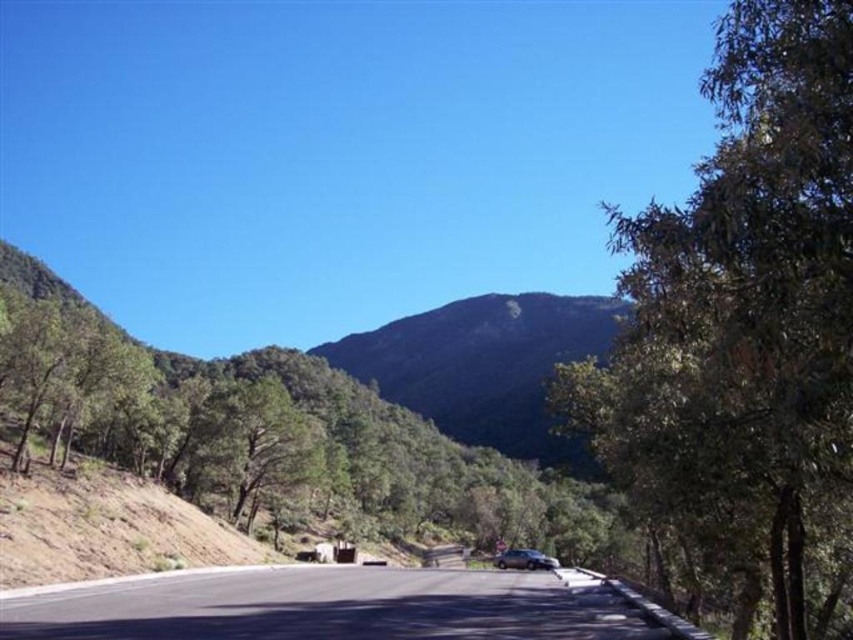
Question: Which of the following is the closest to the observer?

Choices:
 (A) (514, 550)
 (B) (457, 634)

Answer: (B)

Question: Does green leafy tree at center have a greater width compared to black asphalt road at center?

Choices:
 (A) yes
 (B) no

Answer: (A)

Question: Estimate the real-world distances between objects in this image. Which object is closer to the green leafy tree at center?

Choices:
 (A) green forested mountain at center
 (B) green leafy tree at right

Answer: (A)

Question: Estimate the real-world distances between objects in this image. Which object is farther from the green leafy tree at center?

Choices:
 (A) shiny black car at center
 (B) green leafy tree at right
 (C) black asphalt road at center

Answer: (A)

Question: Does green leafy tree at center appear over black asphalt road at center?

Choices:
 (A) yes
 (B) no

Answer: (A)

Question: Is green leafy tree at center further to the viewer compared to black asphalt road at center?

Choices:
 (A) no
 (B) yes

Answer: (B)